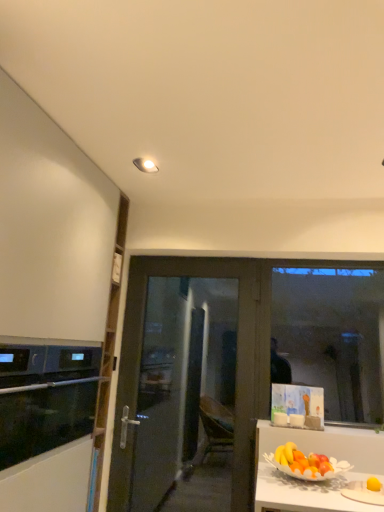
Where is `white matte cabinet at left`? This screenshot has height=512, width=384. white matte cabinet at left is located at coordinates coord(49,305).

What is the approximate width of white matte cabinet at left?

white matte cabinet at left is 13.46 inches in width.

In the scene shown: In order to face black glass oven at left, should I rotate leftwards or rightwards?

You should look left and rotate roughly 18.784 degrees.

I want to click on transparent glass window at right, so click(x=331, y=337).

This screenshot has width=384, height=512. What are the coordinates of `white matte cabinet at left` in the screenshot? It's located at (49, 305).

Would you consider black glass oven at left to be distant from transparent glass door at center?

No, there isn't a large distance between black glass oven at left and transparent glass door at center.

From the image's perspective, between black glass oven at left and transparent glass door at center, which one is located above?

black glass oven at left appears higher in the image.

Does black glass oven at left turn towards transparent glass door at center?

No, black glass oven at left is not facing towards transparent glass door at center.

Is point (78, 264) closer or farther from the camera than point (7, 399)?

Point (78, 264) is farther from the camera than point (7, 399).

Could you tell me if white matte cabinet at left is turned towards black glass oven at left?

Yes.

The image size is (384, 512). Find the location of `kitchen appliance on the right of the white matte cabinet at left`. kitchen appliance on the right of the white matte cabinet at left is located at coordinates (45, 395).

From the image's perspective, is white matte cabinet at left located above or below black glass oven at left?

From the image's perspective, white matte cabinet at left appears above black glass oven at left.

Can you confirm if white matte cabinet at left is positioned to the left of transparent glass door at center?

Yes.

Based on the photo, relative to transparent glass door at center, is white matte cabinet at left in front or behind?

white matte cabinet at left is positioned closer to the viewer than transparent glass door at center.

Between white matte cabinet at left and transparent glass door at center, which one has more height?

white matte cabinet at left.

How distant is white matte cabinet at left from transparent glass door at center?

30.82 inches.

Which of these two, white matte cabinet at left or transparent glass window at right, is smaller?

Smaller between the two is transparent glass window at right.

What's the angular difference between white matte cabinet at left and transparent glass window at right's facing directions?

white matte cabinet at left and transparent glass window at right are facing 89.4 degrees away from each other.

Is white matte cabinet at left facing away from transparent glass window at right?

That's not correct — white matte cabinet at left is not looking away from transparent glass window at right.

From the image's perspective, is white matte cabinet at left located above transparent glass window at right?

Yes, from the image's perspective, white matte cabinet at left is above transparent glass window at right.

Is point (31, 448) farther from camera compared to point (370, 318)?

No, (31, 448) is closer to viewer.

Does black glass oven at left appear on the left side of transparent glass window at right?

Correct, you'll find black glass oven at left to the left of transparent glass window at right.

Between black glass oven at left and transparent glass window at right, which one is positioned behind?

transparent glass window at right.

Is transparent glass window at right taller than transparent glass door at center?

Incorrect, the height of transparent glass window at right is not larger of that of transparent glass door at center.

In the image, is transparent glass window at right positioned in front of or behind transparent glass door at center?

transparent glass window at right is behind transparent glass door at center.

Measure the distance between transparent glass window at right and transparent glass door at center.

transparent glass window at right is 1.29 meters from transparent glass door at center.

Can you confirm if transparent glass window at right is thinner than transparent glass door at center?

Yes, transparent glass window at right is thinner than transparent glass door at center.

Looking at their sizes, would you say transparent glass door at center is wider or thinner than transparent glass window at right?

transparent glass door at center is wider than transparent glass window at right.

Relative to transparent glass window at right, is transparent glass door at center in front or behind?

Clearly, transparent glass door at center is in front of transparent glass window at right.

From the image's perspective, which object appears higher, transparent glass door at center or transparent glass window at right?

transparent glass window at right, from the image's perspective.

Is transparent glass door at center positioned far away from transparent glass window at right?

transparent glass door at center is positioned a significant distance from transparent glass window at right.

The width and height of the screenshot is (384, 512). I want to click on kitchen appliance above the transparent glass door at center (from the image's perspective), so [45, 395].

The image size is (384, 512). I want to click on cabinetry on the left of black glass oven at left, so click(x=49, y=305).

From the image, which object appears to be farther from transparent glass door at center, black glass oven at left or transparent glass window at right?

Based on the image, transparent glass window at right appears to be further to transparent glass door at center.

Based on their spatial positions, is transparent glass door at center or black glass oven at left closer to transparent glass window at right?

transparent glass door at center is closer to transparent glass window at right.

From the image, which object appears to be farther from transparent glass door at center, white matte cabinet at left or transparent glass window at right?

transparent glass window at right lies further to transparent glass door at center than the other object.

Consider the image. Considering their positions, is transparent glass window at right positioned closer to black glass oven at left than white matte cabinet at left?

The object closer to black glass oven at left is white matte cabinet at left.

Based on their spatial positions, is white matte cabinet at left or transparent glass window at right further from black glass oven at left?

transparent glass window at right is further to black glass oven at left.

Based on their spatial positions, is white matte cabinet at left or black glass oven at left closer to transparent glass door at center?

black glass oven at left is closer to transparent glass door at center.

Which object lies nearer to the anchor point transparent glass door at center, transparent glass window at right or black glass oven at left?

The object closer to transparent glass door at center is black glass oven at left.

When comparing their distances from white matte cabinet at left, does transparent glass door at center or transparent glass window at right seem closer?

Based on the image, transparent glass door at center appears to be nearer to white matte cabinet at left.

The width and height of the screenshot is (384, 512). I want to click on kitchen appliance located between white matte cabinet at left and transparent glass door at center in the depth direction, so click(x=45, y=395).

Image resolution: width=384 pixels, height=512 pixels. Identify the location of kitchen appliance between white matte cabinet at left and transparent glass window at right in the horizontal direction. (45, 395).

Find the location of a particular element. door situated between black glass oven at left and transparent glass window at right from left to right is located at coordinates (188, 384).

The width and height of the screenshot is (384, 512). Find the location of `door between white matte cabinet at left and transparent glass window at right`. door between white matte cabinet at left and transparent glass window at right is located at coordinates (188, 384).